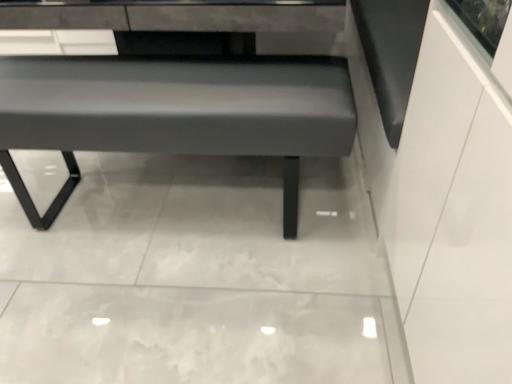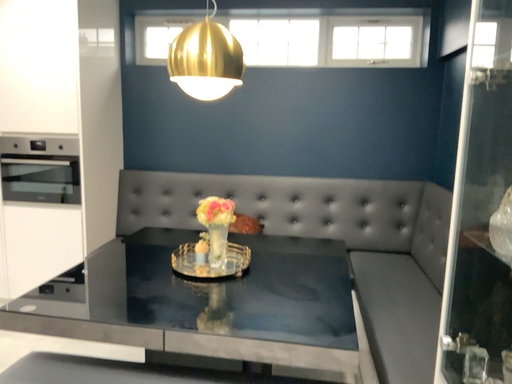
Question: How did the camera likely rotate when shooting the video?

Choices:
 (A) rotated upward
 (B) rotated downward

Answer: (A)